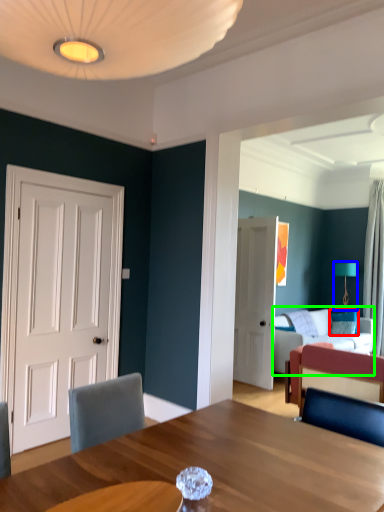
Question: Which object is positioned farthest from pillow (highlighted by a red box)? Select from lamp (highlighted by a blue box) and studio couch (highlighted by a green box).

Choices:
 (A) lamp
 (B) studio couch

Answer: (A)